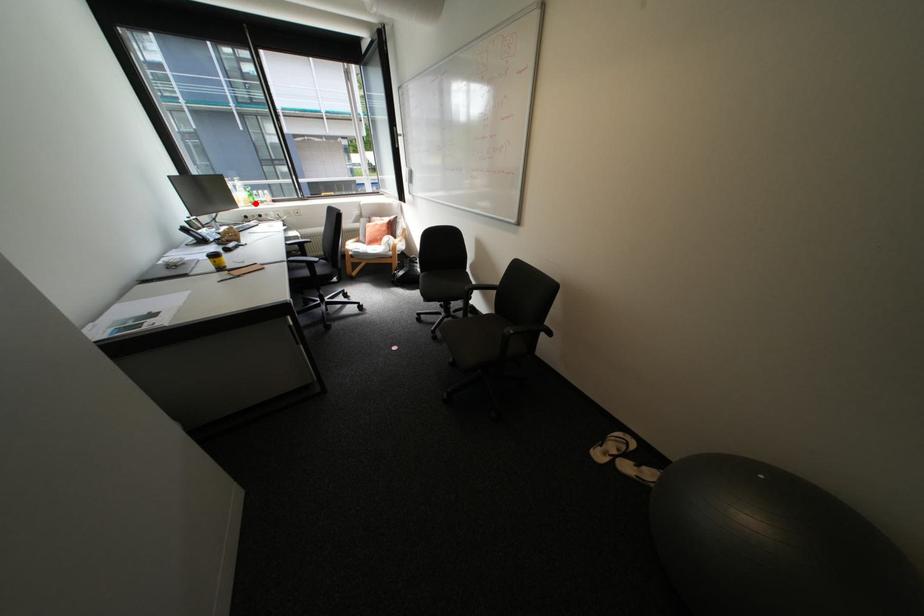
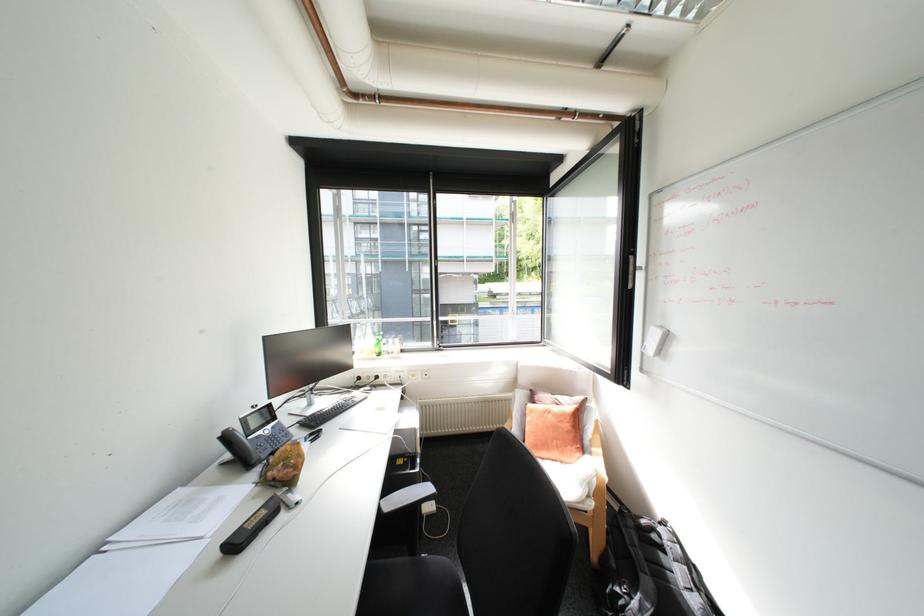
Question: I am providing you with two images of the same scene from different viewpoints. Image1 has a red point marked. In image2, the corresponding 3D location appears at what relative position? Reply with the corresponding letter.

Choices:
 (A) Closer
 (B) Farther

Answer: (B)